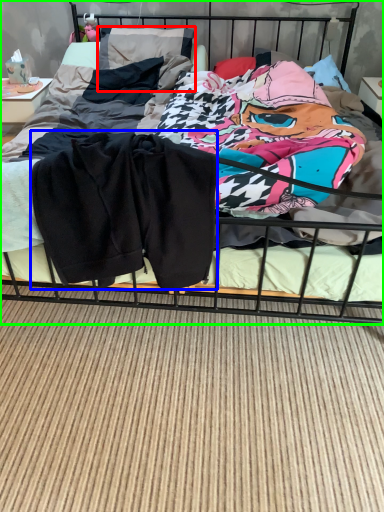
Question: Which object is the closest to the pillow (highlighted by a red box)? Choose among these: baby clothe (highlighted by a blue box) or bed (highlighted by a green box).

Choices:
 (A) baby clothe
 (B) bed

Answer: (B)